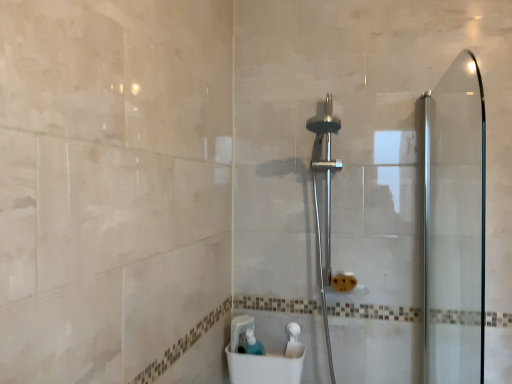
Question: Does translucent plastic soap dispenser at lower center lie behind polished chrome shower head at center?

Choices:
 (A) no
 (B) yes

Answer: (B)

Question: Does translucent plastic soap dispenser at lower center appear on the right side of polished chrome shower head at center?

Choices:
 (A) no
 (B) yes

Answer: (A)

Question: Does translucent plastic soap dispenser at lower center turn towards polished chrome shower head at center?

Choices:
 (A) yes
 (B) no

Answer: (B)

Question: From the image's perspective, is translucent plastic soap dispenser at lower center above polished chrome shower head at center?

Choices:
 (A) no
 (B) yes

Answer: (A)

Question: Is translucent plastic soap dispenser at lower center positioned with its back to polished chrome shower head at center?

Choices:
 (A) yes
 (B) no

Answer: (B)

Question: Is translucent plastic soap dispenser at lower center shorter than polished chrome shower head at center?

Choices:
 (A) no
 (B) yes

Answer: (B)

Question: From a real-world perspective, is transparent glass screen door at right beneath polished chrome shower head at center?

Choices:
 (A) yes
 (B) no

Answer: (B)

Question: Is transparent glass screen door at right facing towards polished chrome shower head at center?

Choices:
 (A) no
 (B) yes

Answer: (B)

Question: Is transparent glass screen door at right positioned with its back to polished chrome shower head at center?

Choices:
 (A) yes
 (B) no

Answer: (A)

Question: Is transparent glass screen door at right shorter than polished chrome shower head at center?

Choices:
 (A) no
 (B) yes

Answer: (B)

Question: Considering the relative positions of transparent glass screen door at right and polished chrome shower head at center in the image provided, is transparent glass screen door at right behind polished chrome shower head at center?

Choices:
 (A) no
 (B) yes

Answer: (A)

Question: Is transparent glass screen door at right bigger than polished chrome shower head at center?

Choices:
 (A) no
 (B) yes

Answer: (A)

Question: Is white plastic sink at lower center not inside transparent glass screen door at right?

Choices:
 (A) no
 (B) yes

Answer: (B)